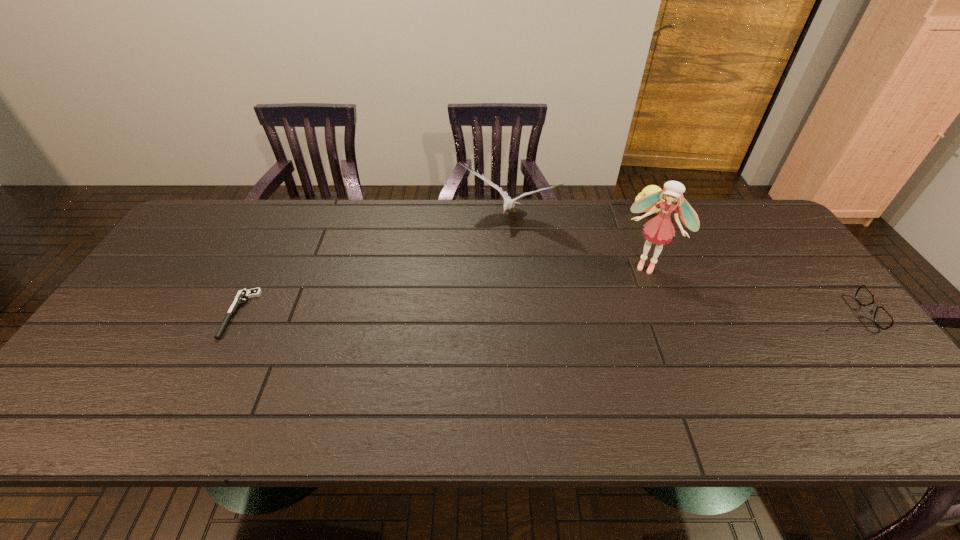
Locate an element on the screen. The width and height of the screenshot is (960, 540). the shortest object is located at coordinates (244, 294).

The image size is (960, 540). In order to click on the leftmost object in this screenshot , I will do `click(244, 294)`.

This screenshot has height=540, width=960. I want to click on the second shortest object, so click(882, 318).

The width and height of the screenshot is (960, 540). Find the location of `sunglasses`. sunglasses is located at coordinates (882, 318).

You are a GUI agent. You are given a task and a screenshot of the screen. Output one action in this format:
    pyautogui.click(x=<x>, y=<y>)
    Task: Click on the doll
    The width and height of the screenshot is (960, 540).
    Given the screenshot: What is the action you would take?
    pyautogui.click(x=659, y=230)

You are a GUI agent. You are given a task and a screenshot of the screen. Output one action in this format:
    pyautogui.click(x=<x>, y=<y>)
    Task: Click on the third farthest object
    The image size is (960, 540).
    Given the screenshot: What is the action you would take?
    pyautogui.click(x=659, y=230)

Locate an element on the screen. This screenshot has width=960, height=540. the second object from left to right is located at coordinates (509, 203).

Where is `the second tallest object`? the second tallest object is located at coordinates (509, 203).

The width and height of the screenshot is (960, 540). Identify the location of duckling. (650, 189).

The width and height of the screenshot is (960, 540). Identify the location of vacant space located on the front-facing side of the pistol. (208, 379).